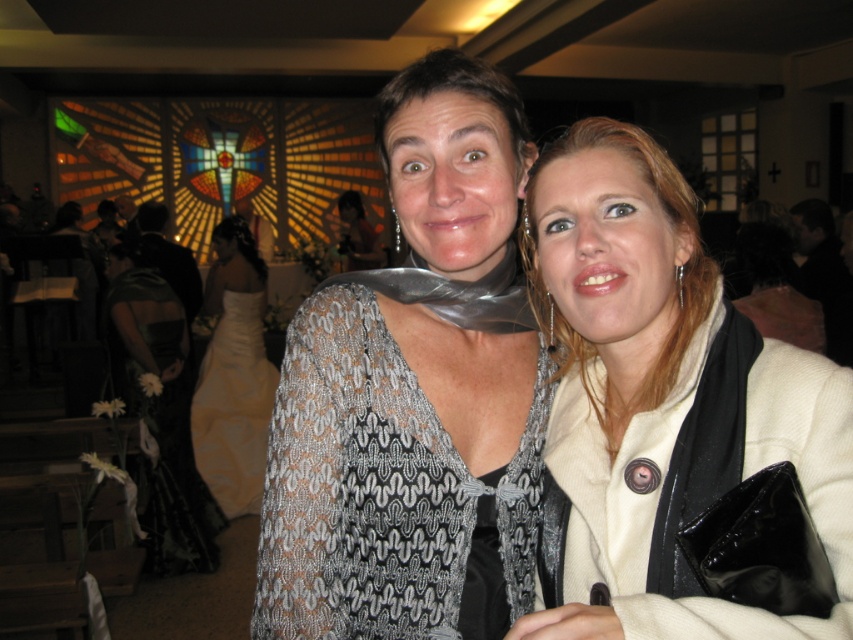
You are a photographer at a wedding reception and need to capture a photo of both the black satin dress at left and the silver metallic dress at center. Since you want both dresses to be in focus, which one should you focus on first to ensure depth of field?

You should focus on the black satin dress at left first because it is closer to the viewer than the silver metallic dress at center, so adjusting the focus from near to far will help both be in focus.

You are a photographer at a wedding reception and need to capture a photo of the black satin dress at left and the silver metallic dress at center. Which dress should you focus on first if you want to include both in the frame without moving the camera?

The black satin dress at left is positioned on the left side of the silver metallic dress at center, so you should focus on the silver metallic dress at center first to ensure both are in the frame without moving the camera.